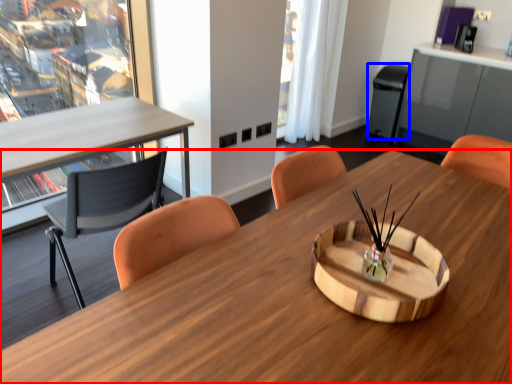
Question: Which object appears farthest to the camera in this image, desk (highlighted by a red box) or trash bin/can (highlighted by a blue box)?

Choices:
 (A) desk
 (B) trash bin/can

Answer: (B)